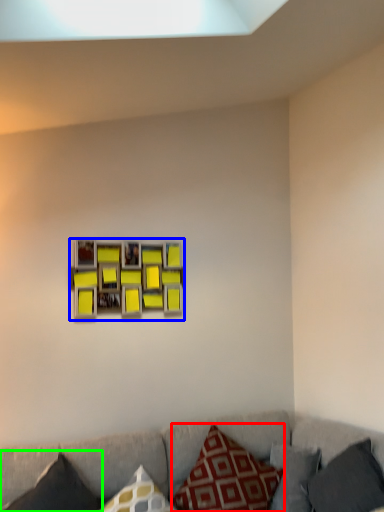
Question: Which object is positioned closest to pillow (highlighted by a red box)? Select from picture frame (highlighted by a blue box) and pillow (highlighted by a green box).

Choices:
 (A) picture frame
 (B) pillow

Answer: (B)